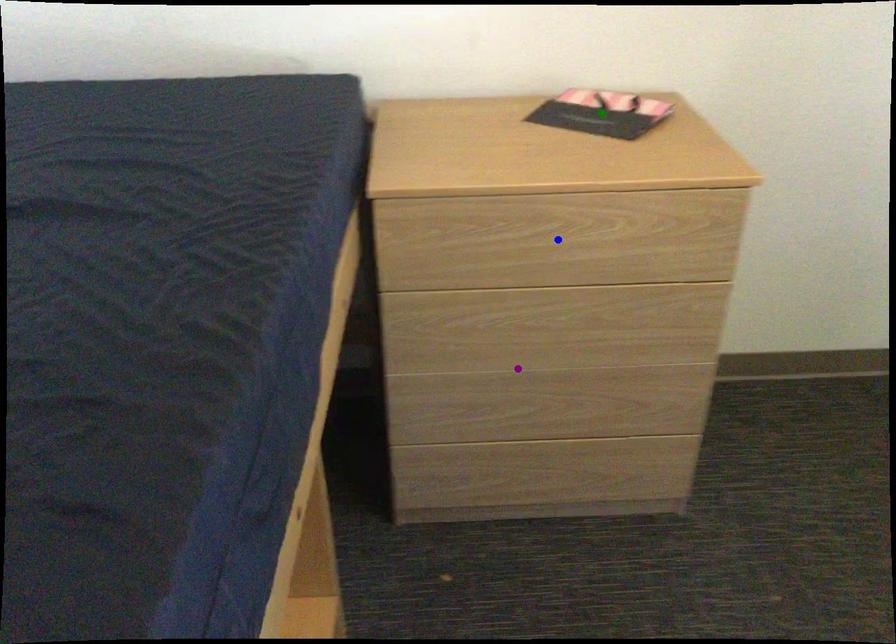
Order these from nearest to farthest:
blue point | purple point | green point

blue point → green point → purple point